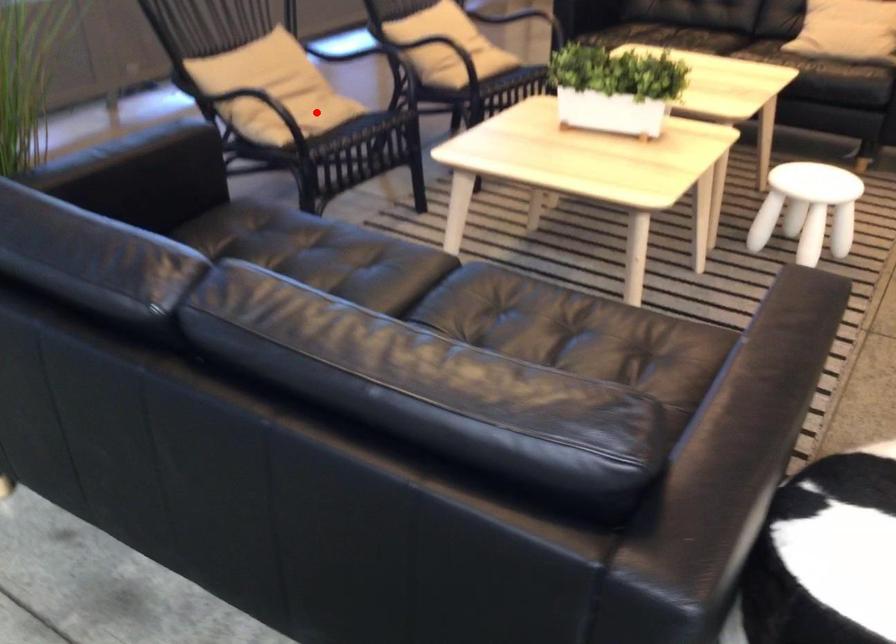
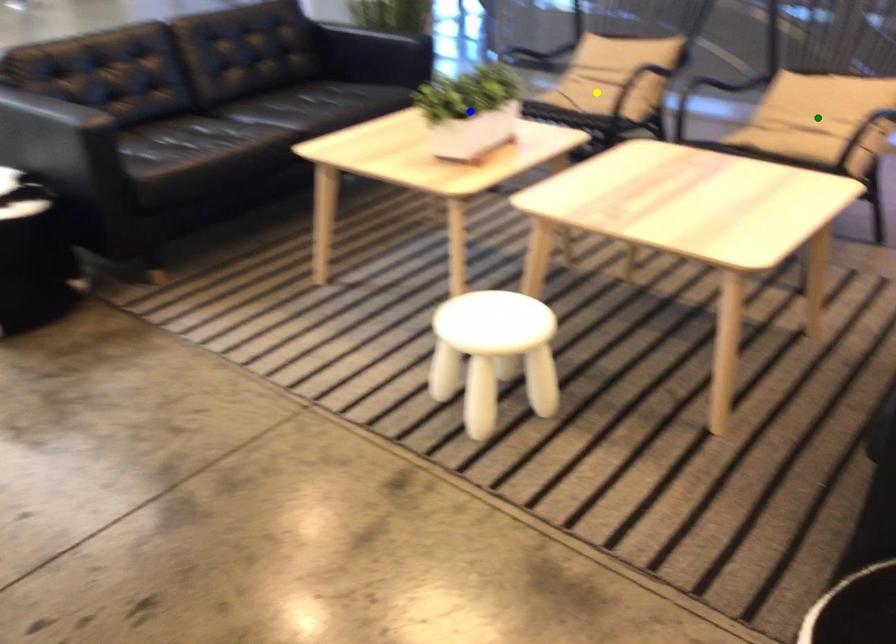
Question: I am providing you with two images of the same scene from different viewpoints. A red point is marked on the first image. You are given multiple points on the second image. Which point in image 2 is actually the same real-world point as the red point in image 1?

Choices:
 (A) yellow point
 (B) blue point
 (C) green point

Answer: (A)